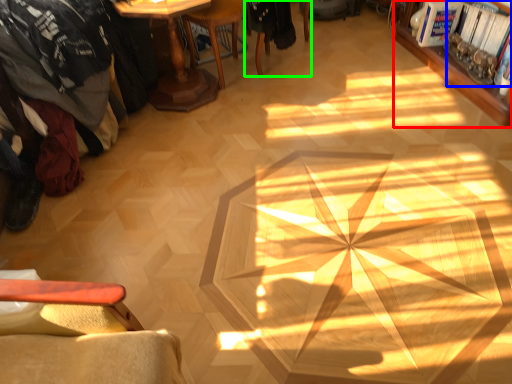
Question: Considering the real-world distances, which object is closest to bookcase (highlighted by a red box)? magazine (highlighted by a blue box) or chair (highlighted by a green box).

Choices:
 (A) magazine
 (B) chair

Answer: (A)